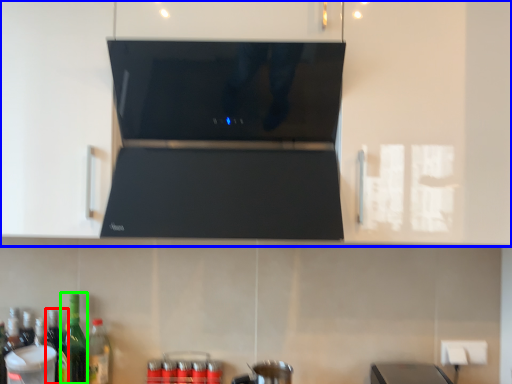
Question: Which is farther away from bottle (highlighted by a red box)? cabinetry (highlighted by a blue box) or bottle (highlighted by a green box)?

Choices:
 (A) cabinetry
 (B) bottle

Answer: (A)